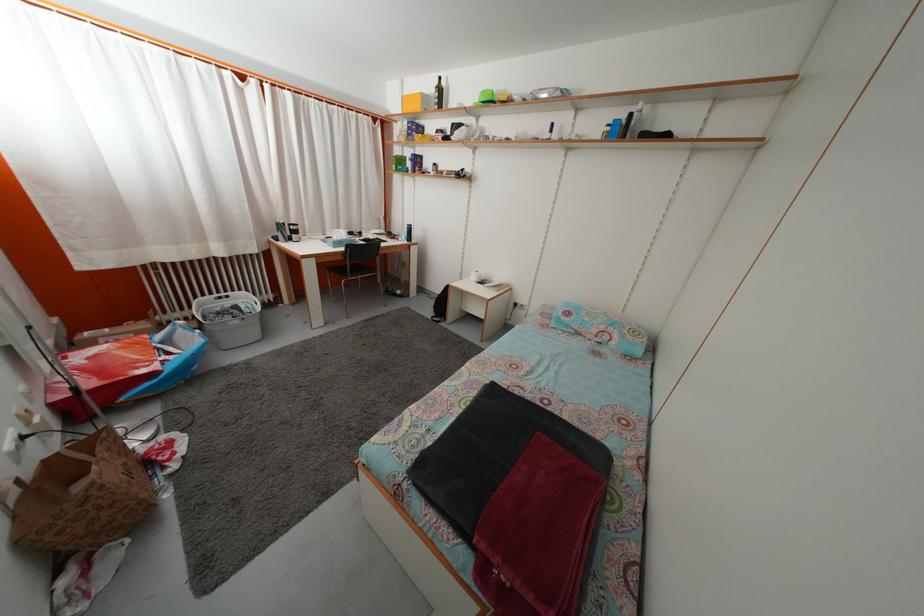
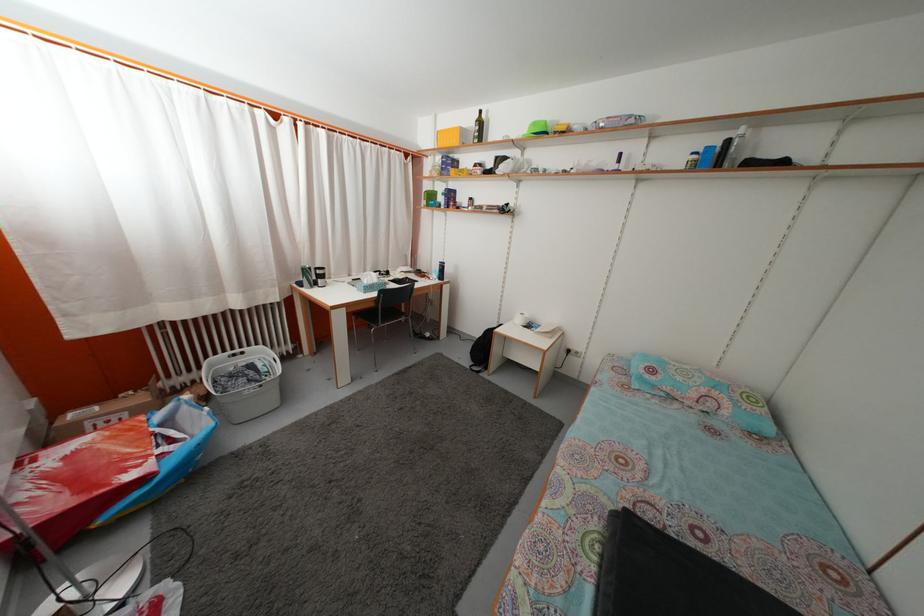
Find the pixel in the second image that matches the point at 430,105 in the first image.

(468, 139)